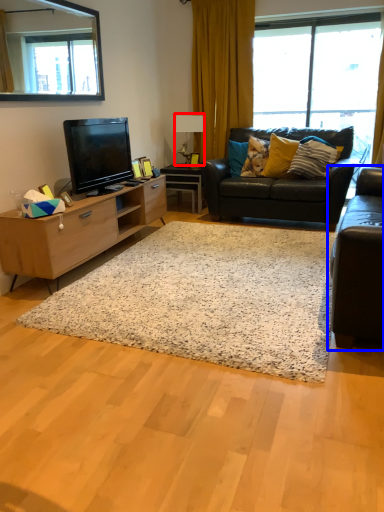
Question: Among these objects, which one is farthest to the camera, lamp (highlighted by a red box) or studio couch (highlighted by a blue box)?

Choices:
 (A) lamp
 (B) studio couch

Answer: (A)